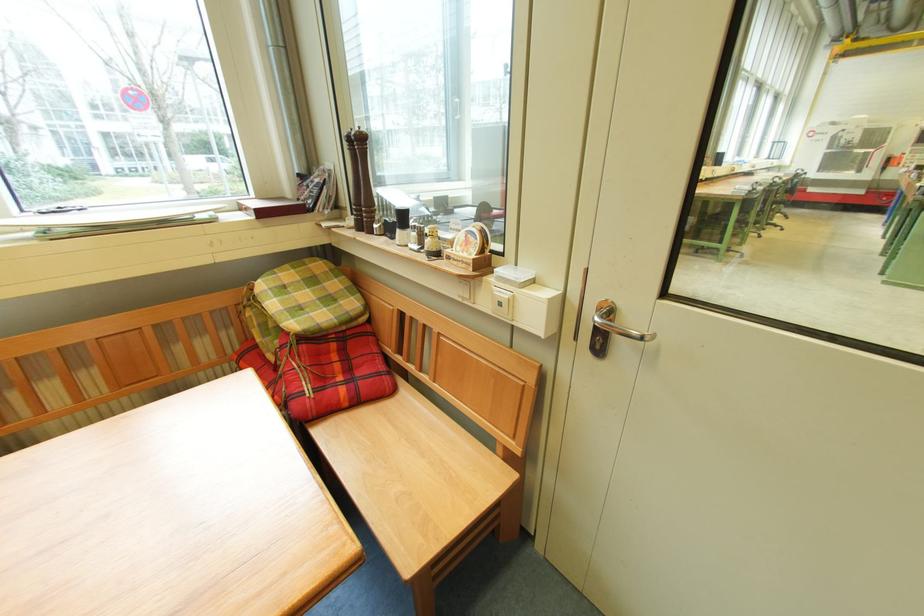
At what (x,y) coordinates should I click in order to perform the action: click on red plaid cushion. Please return your answer as a coordinate pair (x, y). Looking at the image, I should click on (321, 371).